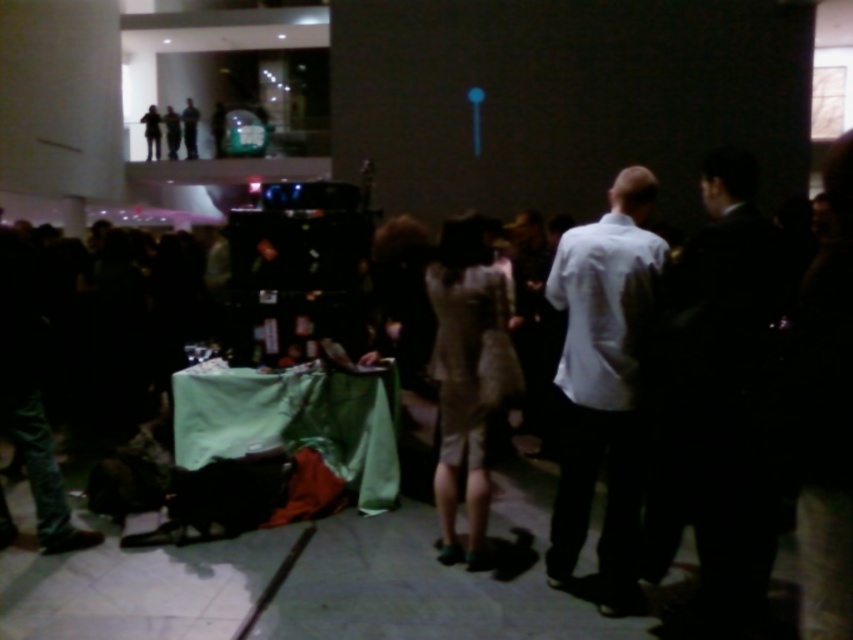
You are a photographer at the event and want to capture a clear photo of both the dark suit at right and the white matte shirt at center. Since the scene is blurry, you decide to adjust your camera focus. Which subject should you focus on first to ensure their clothing details are clear, considering their sizes?

The dark suit at right is much taller than the white matte shirt at center, so focusing on the dark suit at right first would ensure its larger details are captured clearly before adjusting for the smaller subject.

You are at a party and want to approach the dark suit at right and the white matte shirt at center. Which one would you need to walk towards first if you are standing to the left of both?

You should approach the white matte shirt at center first because the dark suit at right is to the right of the white matte shirt at center, meaning the white matte shirt at center is closer to your left position.

You are at the event and want to take a photo of the person in the center wearing a white shirt and dark pants. The camera you have can only focus on objects within 8 feet. Is the point where the person is standing, which is at point (x=711, y=282), within the camera focus range?

The point (x=711, y=282) is 8.28 feet away from the camera. Since the camera can only focus within 8 feet, the person is slightly out of range.